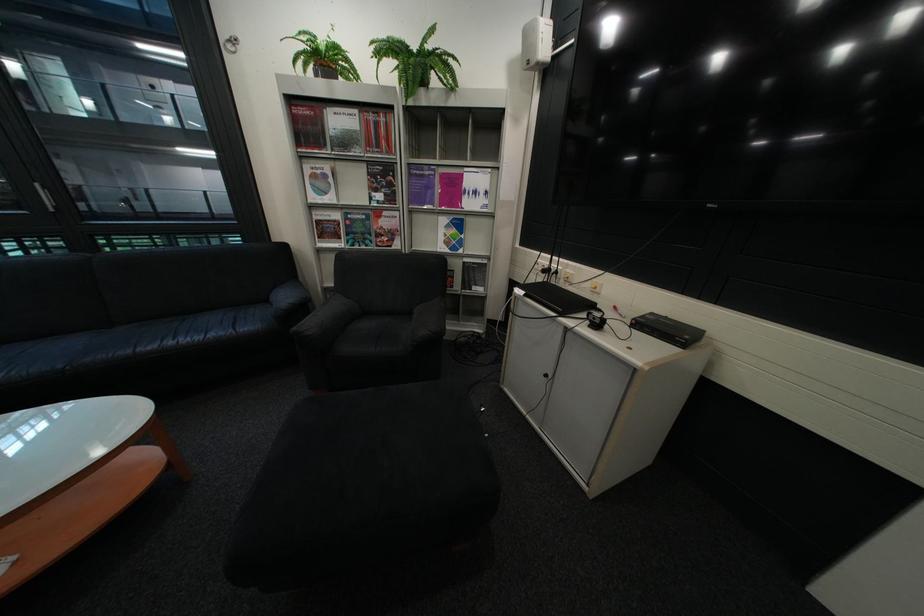
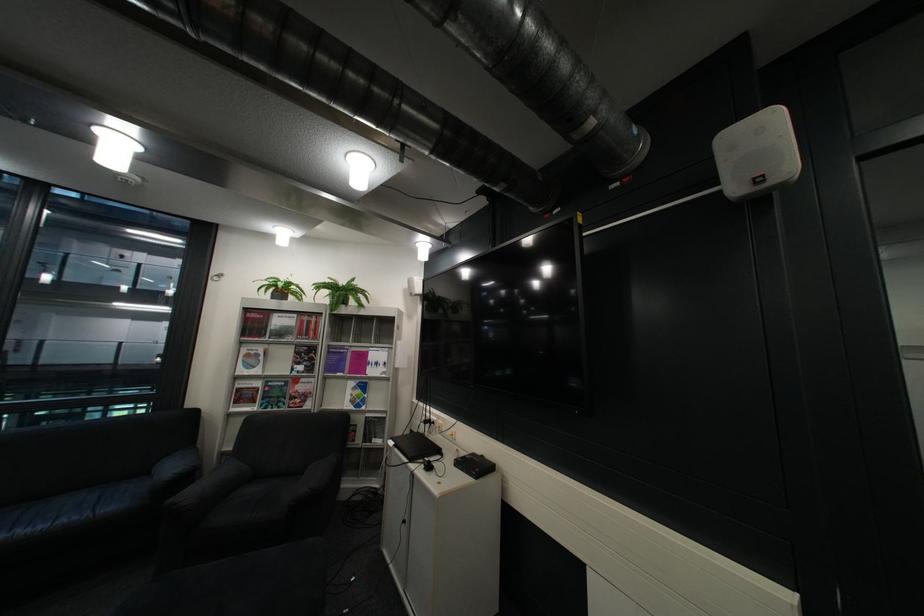
The point at (x=324, y=325) is marked in the first image. Where is the corresponding point in the second image?

(204, 495)